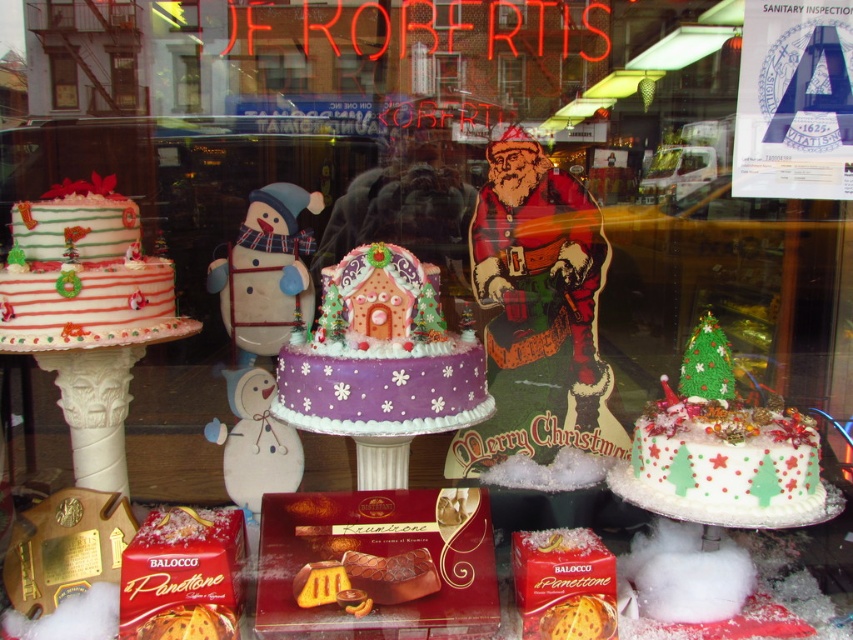
Is clear glass window at center to the left of matte white snowman at center from the viewer's perspective?

No, clear glass window at center is not to the left of matte white snowman at center.

Locate an element on the screen. The image size is (853, 640). clear glass window at center is located at coordinates (186, 81).

Which is behind, point (173, 298) or point (245, 484)?

The point (245, 484) is more distant.

I want to click on white striped cake at left, so click(83, 275).

Does plush fabric snowman at center lie behind clear glass window at center?

No, it is in front of clear glass window at center.

Does plush fabric snowman at center appear under clear glass window at center?

Correct, plush fabric snowman at center is located below clear glass window at center.

Which is in front, point (257, 192) or point (192, 68)?

Point (257, 192) is more forward.

What are the coordinates of `plush fabric snowman at center` in the screenshot? It's located at (265, 269).